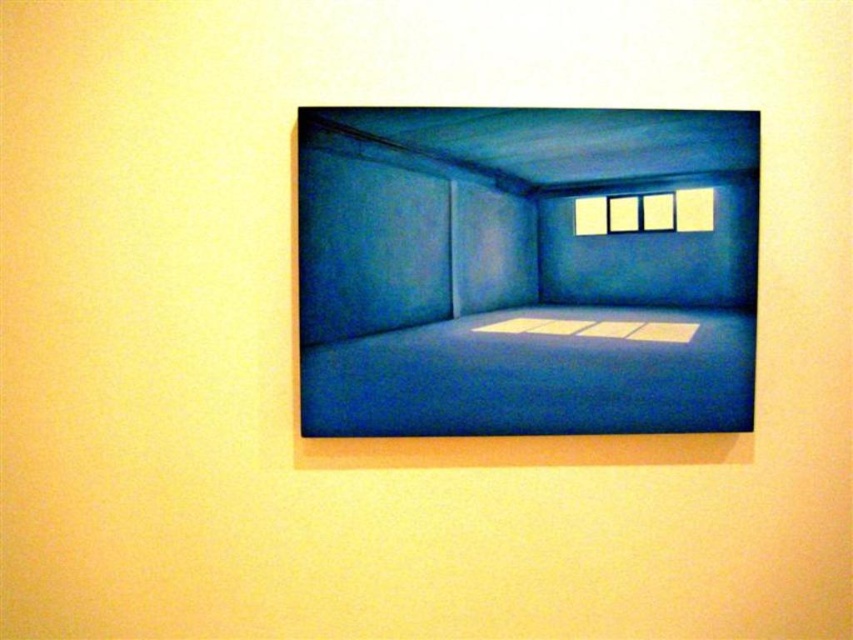
Is blue matte room at center positioned behind white matte window at upper center?

No, blue matte room at center is closer to the viewer.

Can you confirm if blue matte room at center is positioned to the right of white matte window at upper center?

In fact, blue matte room at center is to the left of white matte window at upper center.

This screenshot has width=853, height=640. Identify the location of blue matte room at center. (521, 273).